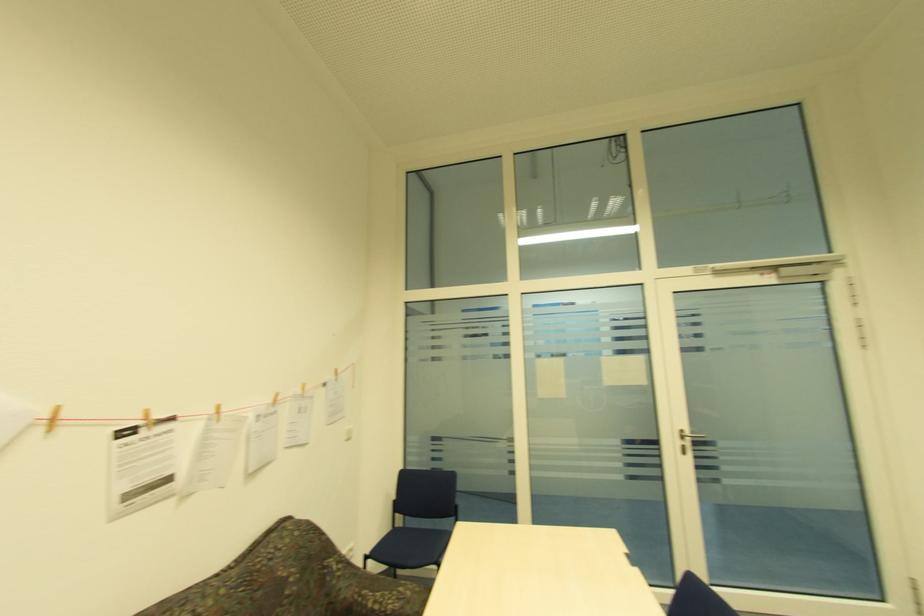
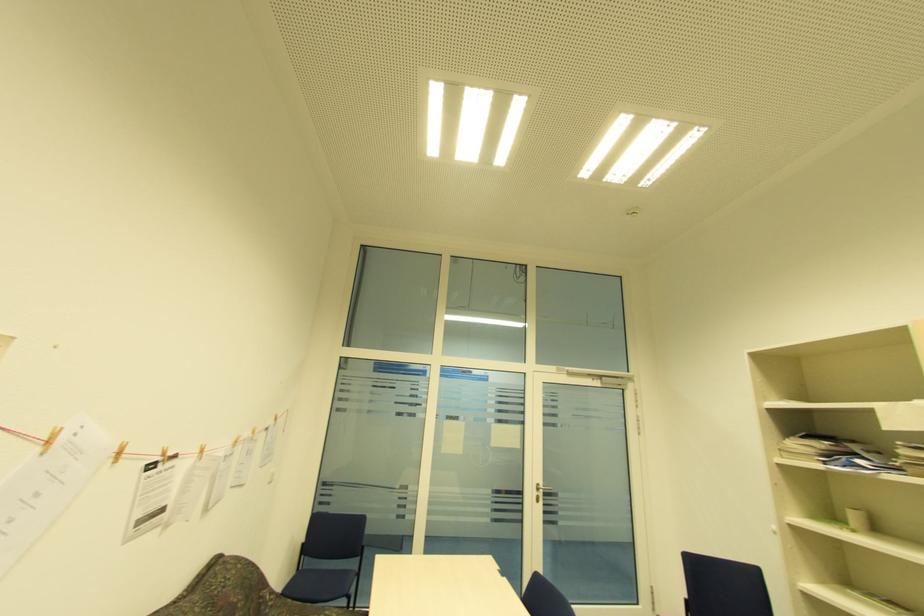
Question: Based on the continuous images, in which direction is the camera rotating? Reply with the corresponding letter.

Choices:
 (A) Left
 (B) Right
 (C) Up
 (D) Down

Answer: (B)